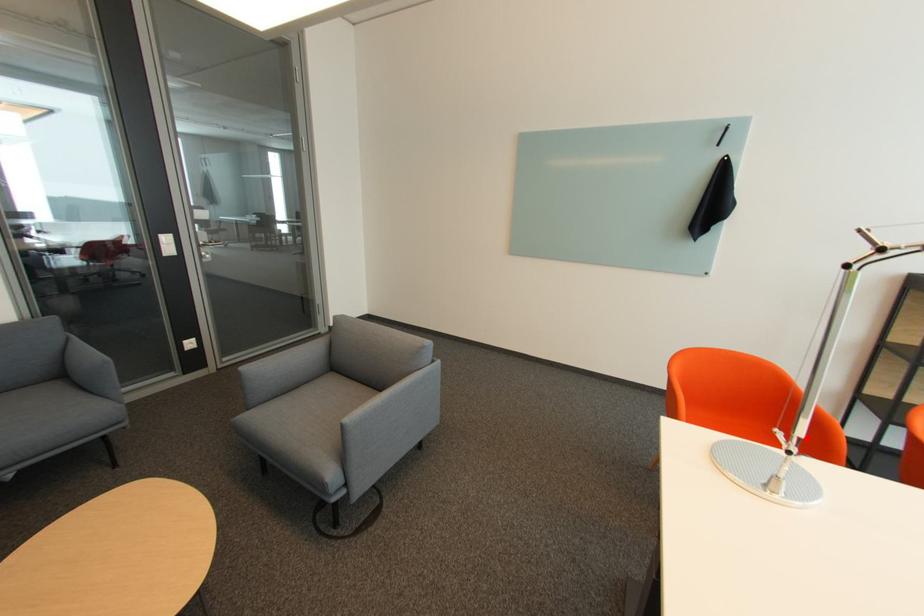
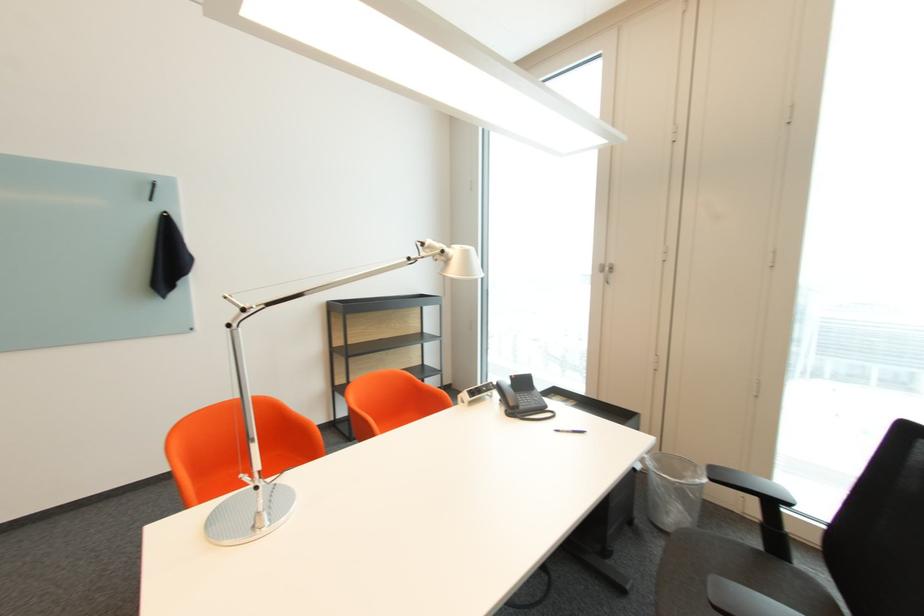
Question: I am providing you with two images of the same scene from different viewpoints. Given a red point in image1, look at the same physical point in image2. Is it:

Choices:
 (A) Closer to the viewpoint
 (B) Farther from the viewpoint

Answer: (B)